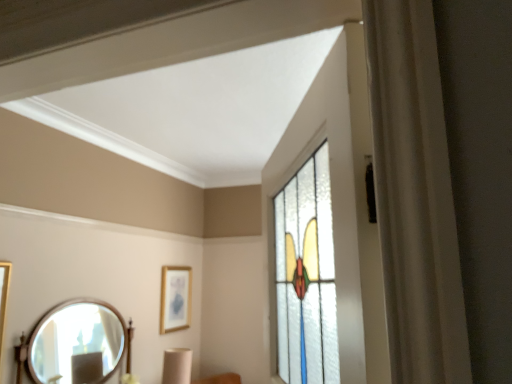
Locate an element on the screen. This screenshot has height=384, width=512. wooden framed mirror at lower left is located at coordinates (77, 343).

The height and width of the screenshot is (384, 512). Describe the element at coordinates (77, 343) in the screenshot. I see `wooden framed mirror at lower left` at that location.

Find the location of a particular element. The height and width of the screenshot is (384, 512). gold-framed picture at center is located at coordinates (175, 298).

Describe the element at coordinates (175, 298) in the screenshot. I see `gold-framed picture at center` at that location.

Locate an element on the screen. wooden framed mirror at lower left is located at coordinates (77, 343).

In the image, is wooden framed mirror at lower left on the left side or the right side of gold-framed picture at center?

From the image, it's evident that wooden framed mirror at lower left is to the left of gold-framed picture at center.

Considering their positions, is wooden framed mirror at lower left located in front of or behind gold-framed picture at center?

Clearly, wooden framed mirror at lower left is in front of gold-framed picture at center.

Which point is more distant from viewer, (96, 351) or (168, 301)?

The point (168, 301) is more distant.

From the image's perspective, between wooden framed mirror at lower left and gold-framed picture at center, who is located below?

wooden framed mirror at lower left is shown below in the image.

From a real-world perspective, between wooden framed mirror at lower left and gold-framed picture at center, who is vertically lower?

In real-world perspective, wooden framed mirror at lower left is lower.

Looking at their sizes, would you say wooden framed mirror at lower left is wider or thinner than gold-framed picture at center?

Considering their sizes, wooden framed mirror at lower left looks broader than gold-framed picture at center.

Considering the relative sizes of wooden framed mirror at lower left and gold-framed picture at center in the image provided, is wooden framed mirror at lower left shorter than gold-framed picture at center?

Incorrect, the height of wooden framed mirror at lower left does not fall short of that of gold-framed picture at center.

Considering the relative sizes of wooden framed mirror at lower left and gold-framed picture at center in the image provided, is wooden framed mirror at lower left bigger than gold-framed picture at center?

Yes.

Looking at this image, is gold-framed picture at center a part of wooden framed mirror at lower left?

No.

Is wooden framed mirror at lower left positioned far away from gold-framed picture at center?

No, wooden framed mirror at lower left is not far away from gold-framed picture at center.

Is wooden framed mirror at lower left turned away from gold-framed picture at center?

That's not correct — wooden framed mirror at lower left is not looking away from gold-framed picture at center.

At what (x,y) coordinates should I click in order to perform the action: click on mirror in front of the gold-framed picture at center. Please return your answer as a coordinate pair (x, y). Image resolution: width=512 pixels, height=384 pixels. Looking at the image, I should click on (77, 343).

Considering the positions of objects gold-framed picture at center and wooden framed mirror at lower left in the image provided, who is more to the right, gold-framed picture at center or wooden framed mirror at lower left?

gold-framed picture at center.

Is the position of gold-framed picture at center more distant than that of wooden framed mirror at lower left?

Yes, gold-framed picture at center is behind wooden framed mirror at lower left.

Is point (165, 284) positioned behind point (91, 341)?

Yes, it is.

From the image's perspective, is gold-framed picture at center on wooden framed mirror at lower left?

Yes, from the image's perspective, gold-framed picture at center is on top of wooden framed mirror at lower left.

From a real-world perspective, between gold-framed picture at center and wooden framed mirror at lower left, who is vertically higher?

In real-world perspective, gold-framed picture at center is above.

Can you confirm if gold-framed picture at center is wider than wooden framed mirror at lower left?

Incorrect, the width of gold-framed picture at center does not surpass that of wooden framed mirror at lower left.

Does gold-framed picture at center have a greater height compared to wooden framed mirror at lower left?

No, gold-framed picture at center is not taller than wooden framed mirror at lower left.

Who is smaller, gold-framed picture at center or wooden framed mirror at lower left?

Smaller between the two is gold-framed picture at center.

Is gold-framed picture at center not within wooden framed mirror at lower left?

Yes, gold-framed picture at center is outside of wooden framed mirror at lower left.

Is gold-framed picture at center far away from wooden framed mirror at lower left?

No, there isn't a large distance between gold-framed picture at center and wooden framed mirror at lower left.

Is gold-framed picture at center looking in the opposite direction of wooden framed mirror at lower left?

gold-framed picture at center is not turned away from wooden framed mirror at lower left.

How different are the orientations of gold-framed picture at center and wooden framed mirror at lower left in degrees?

7.31e-05 degrees separate the facing orientations of gold-framed picture at center and wooden framed mirror at lower left.

The image size is (512, 384). Identify the location of picture frame that is above the wooden framed mirror at lower left (from the image's perspective). (175, 298).

What are the coordinates of `picture frame behind the wooden framed mirror at lower left` in the screenshot? It's located at (175, 298).

You are a GUI agent. You are given a task and a screenshot of the screen. Output one action in this format:
    pyautogui.click(x=<x>, y=<y>)
    Task: Click on the mirror below the gold-framed picture at center (from a real-world perspective)
    The image size is (512, 384).
    Given the screenshot: What is the action you would take?
    pyautogui.click(x=77, y=343)